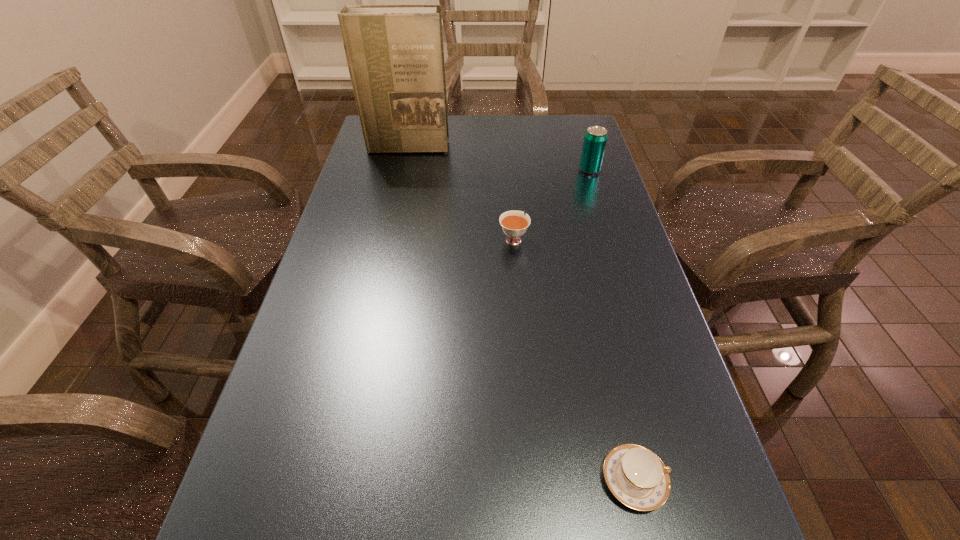
I want to click on free space between the third farthest object and the leftmost object, so click(460, 193).

At what (x,y) coordinates should I click in order to perform the action: click on unoccupied position between the left teacup and the tallest object. Please return your answer as a coordinate pair (x, y). The width and height of the screenshot is (960, 540). Looking at the image, I should click on (460, 193).

The height and width of the screenshot is (540, 960). In order to click on the second closest object to the third nearest object in this screenshot , I will do `click(395, 55)`.

Locate which object ranks in proximity to the shortest object. Please provide its 2D coordinates. Your answer should be formatted as a tuple, i.e. [(x, y)], where the tuple contains the x and y coordinates of a point satisfying the conditions above.

[(514, 224)]

I want to click on free space that satisfies the following two spatial constraints: 1. on the front side of the rightmost object; 2. on the side with the handle of the shorter teacup, so click(x=686, y=480).

Find the location of a particular element. This screenshot has height=540, width=960. free space that satisfies the following two spatial constraints: 1. on the side of the second shortest object with the handle; 2. on the right side of the second farthest object is located at coordinates (508, 170).

Image resolution: width=960 pixels, height=540 pixels. In order to click on free spot that satisfies the following two spatial constraints: 1. on the side of the beer can with the handle; 2. on the right side of the third object from right to left in this screenshot , I will do `click(508, 170)`.